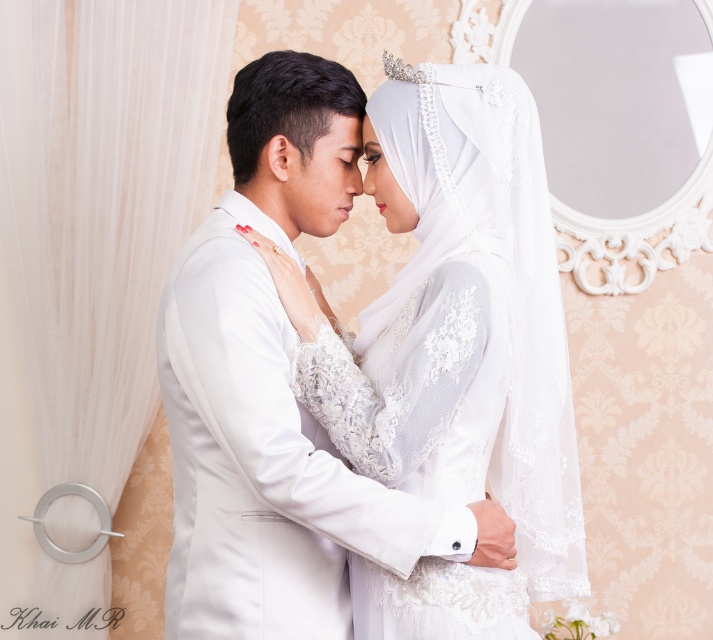
Based on the photo, you are a photographer at a wedding and want to capture a photo of the two people. You notice two points marked in the image. The first point is at coordinate point (466, 429) and the second is at point (501, 371). Based on their positions, which point is closer to the photographer?

Point (501, 371) is closer to the photographer because the description states that point (466, 429) is behind point (501, 371).

In the image, there is a white lace dress at center and a point marked at coordinates (453,352). Which object corresponds to this coordinate?

The point at (453,352) corresponds to the white lace dress at center.

You are a photographer at a wedding and need to capture a closeup shot of the matte white forehead at center without the white lace dress at center blocking the view. Is this possible given their sizes?

The white lace dress at center has a larger size compared to matte white forehead at center, so it may block the view. Adjust the camera angle to focus solely on the matte white forehead at center by moving around the dress.